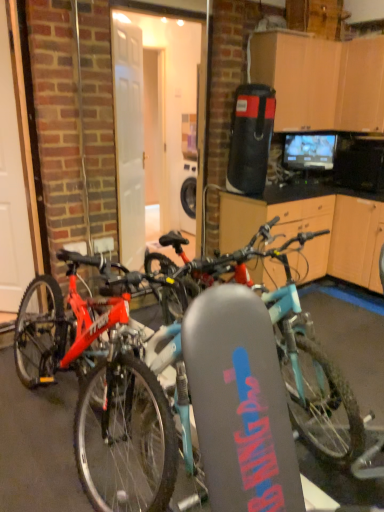
Find the location of a particular element. white glossy door at left is located at coordinates (15, 170).

The image size is (384, 512). Describe the element at coordinates (15, 170) in the screenshot. I see `white glossy door at left` at that location.

Measure the distance between matte red bicycle at center and camera.

A distance of 1.46 meters exists between matte red bicycle at center and camera.

This screenshot has height=512, width=384. Describe the element at coordinates (211, 397) in the screenshot. I see `matte red bicycle at center` at that location.

Locate an element on the screen. The width and height of the screenshot is (384, 512). matte red bicycle at center is located at coordinates (211, 397).

In order to face matte red bicycle at center, should I rotate leftwards or rightwards?

It's best to rotate right around 4.876 degrees.

Locate an element on the screen. white glossy door at left is located at coordinates (15, 170).

Is matte red bicycle at center at the right side of white glossy door at left?

Correct, you'll find matte red bicycle at center to the right of white glossy door at left.

Which is in front, matte red bicycle at center or white glossy door at left?

matte red bicycle at center is more forward.

Does point (285, 336) appear closer or farther from the camera than point (26, 266)?

Point (285, 336) is positioned closer to the camera compared to point (26, 266).

From the image's perspective, between matte red bicycle at center and white glossy door at left, which one is located above?

white glossy door at left.

From a real-world perspective, relative to white glossy door at left, is matte red bicycle at center vertically above or below?

matte red bicycle at center is situated lower than white glossy door at left in the real world.

Which of these two, matte red bicycle at center or white glossy door at left, is wider?

matte red bicycle at center.

From their relative heights in the image, would you say matte red bicycle at center is taller or shorter than white glossy door at left?

Considering their sizes, matte red bicycle at center has less height than white glossy door at left.

Considering the sizes of matte red bicycle at center and white glossy door at left in the image, is matte red bicycle at center bigger or smaller than white glossy door at left?

In the image, matte red bicycle at center appears to be larger than white glossy door at left.

Do you think matte red bicycle at center is within white glossy door at left, or outside of it?

matte red bicycle at center cannot be found inside white glossy door at left.

Is matte red bicycle at center in contact with white glossy door at left?

No, matte red bicycle at center is not in contact with white glossy door at left.

Is matte red bicycle at center aimed at white glossy door at left?

No, matte red bicycle at center is not facing towards white glossy door at left.

Can you tell me how much matte red bicycle at center and white glossy door at left differ in facing direction?

The angle between the facing direction of matte red bicycle at center and the facing direction of white glossy door at left is 46.5 degrees.

How distant is matte red bicycle at center from white glossy door at left?

matte red bicycle at center and white glossy door at left are 4.00 feet apart.

I want to click on garage door located above the matte red bicycle at center (from the image's perspective), so click(15, 170).

Would you say white glossy door at left is to the left or to the right of matte red bicycle at center in the picture?

white glossy door at left is to the left of matte red bicycle at center.

Based on the photo, considering their positions, is white glossy door at left located in front of or behind matte red bicycle at center?

Answer: white glossy door at left is behind matte red bicycle at center.

Which is more distant, (16, 221) or (231, 272)?

The point (16, 221) is behind.

From the image's perspective, is white glossy door at left positioned above or below matte red bicycle at center?

From the image's perspective, white glossy door at left appears above matte red bicycle at center.

In the scene shown: From a real-world perspective, which object stands above the other?

A: white glossy door at left is physically above.

Can you confirm if white glossy door at left is thinner than matte red bicycle at center?

Indeed, white glossy door at left has a lesser width compared to matte red bicycle at center.

Is white glossy door at left shorter than matte red bicycle at center?

In fact, white glossy door at left may be taller than matte red bicycle at center.

Is white glossy door at left bigger than matte red bicycle at center?

Actually, white glossy door at left might be smaller than matte red bicycle at center.

Would you say white glossy door at left is inside or outside matte red bicycle at center?

The correct answer is: outside.

Is white glossy door at left in contact with matte red bicycle at center?

No, white glossy door at left is not making contact with matte red bicycle at center.

Could you tell me if white glossy door at left is turned towards matte red bicycle at center?

No, white glossy door at left does not turn towards matte red bicycle at center.

Can you tell me how much white glossy door at left and matte red bicycle at center differ in facing direction?

46.5 degrees.

Measure the distance from white glossy door at left to matte red bicycle at center.

They are 4.00 feet apart.

This screenshot has width=384, height=512. Identify the location of garage door on the left of the matte red bicycle at center. (15, 170).

Identify the location of garage door above the matte red bicycle at center (from the image's perspective). The image size is (384, 512). click(x=15, y=170).

Find the location of a particular element. bicycle on the right of white glossy door at left is located at coordinates (211, 397).